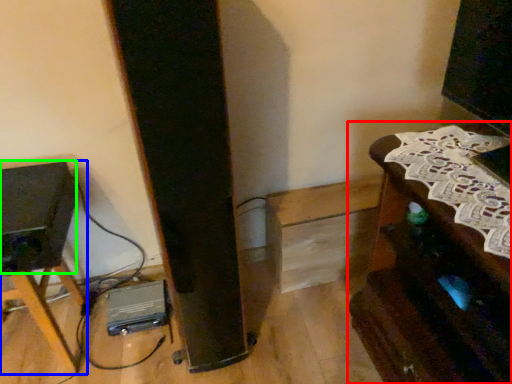
Question: Based on their relative distances, which object is farther from furniture (highlighted by a red box)? Choose from furniture (highlighted by a blue box) and speaker (highlighted by a green box).

Choices:
 (A) furniture
 (B) speaker

Answer: (A)